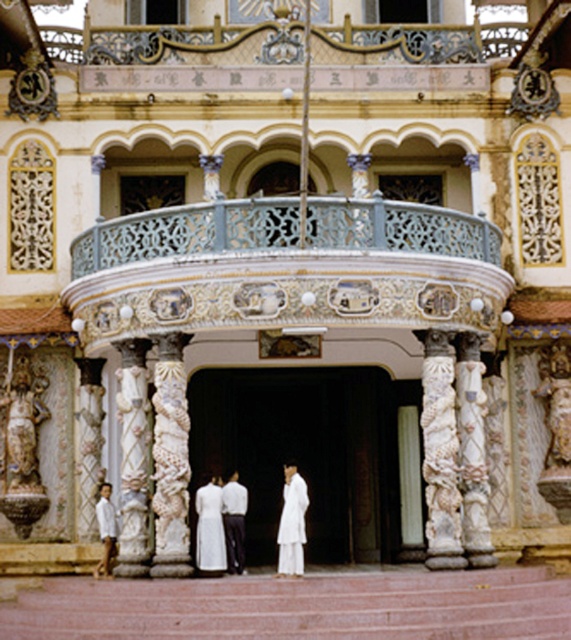
Who is positioned more to the right, reddish-brown stone stairs at center or white cotton shirt at lower left?

reddish-brown stone stairs at center

Is point (395, 627) farther from viewer compared to point (104, 545)?

No, (395, 627) is closer to viewer.

Locate an element on the screen. This screenshot has height=640, width=571. reddish-brown stone stairs at center is located at coordinates (299, 605).

Where is `reddish-brown stone stairs at center`? The image size is (571, 640). reddish-brown stone stairs at center is located at coordinates tap(299, 605).

Which is more to the left, reddish-brown stone stairs at center or white silk dress at center?

Positioned to the left is reddish-brown stone stairs at center.

Locate an element on the screen. This screenshot has height=640, width=571. reddish-brown stone stairs at center is located at coordinates (299, 605).

In order to click on reddish-brown stone stairs at center in this screenshot , I will do `click(299, 605)`.

Between reddish-brown stone stairs at center and carved stone statue at center, which one has less height?

reddish-brown stone stairs at center

Does reddish-brown stone stairs at center have a lesser width compared to carved stone statue at center?

No, reddish-brown stone stairs at center is not thinner than carved stone statue at center.

Where is `reddish-brown stone stairs at center`? The width and height of the screenshot is (571, 640). reddish-brown stone stairs at center is located at coordinates (299, 605).

Image resolution: width=571 pixels, height=640 pixels. I want to click on reddish-brown stone stairs at center, so click(299, 605).